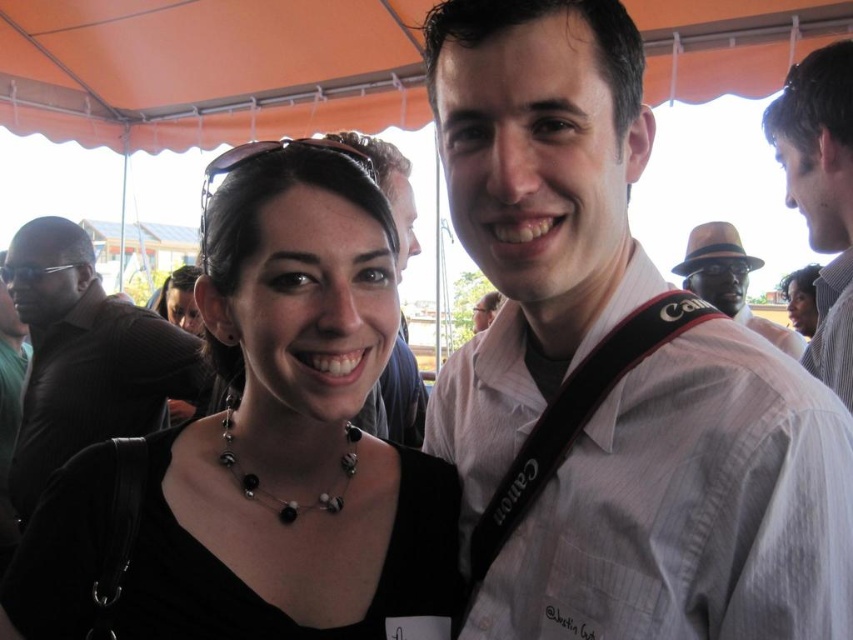
You are taking a photo of the scene and want to ensure both the white striped shirt at center and the black matte necklace at center are clearly visible. Given their sizes, which one might require you to adjust your camera focus more carefully to avoid blurriness?

The white striped shirt at center is larger in size than the black matte necklace at center, so the necklace might require more careful focus adjustment to ensure clarity since it is smaller and details could be harder to capture.

You are standing in the crowd at the event and want to find the white striped shirt at center. According to the image coordinates, where should you look?

The white striped shirt at center is located at coordinates point (689, 508).